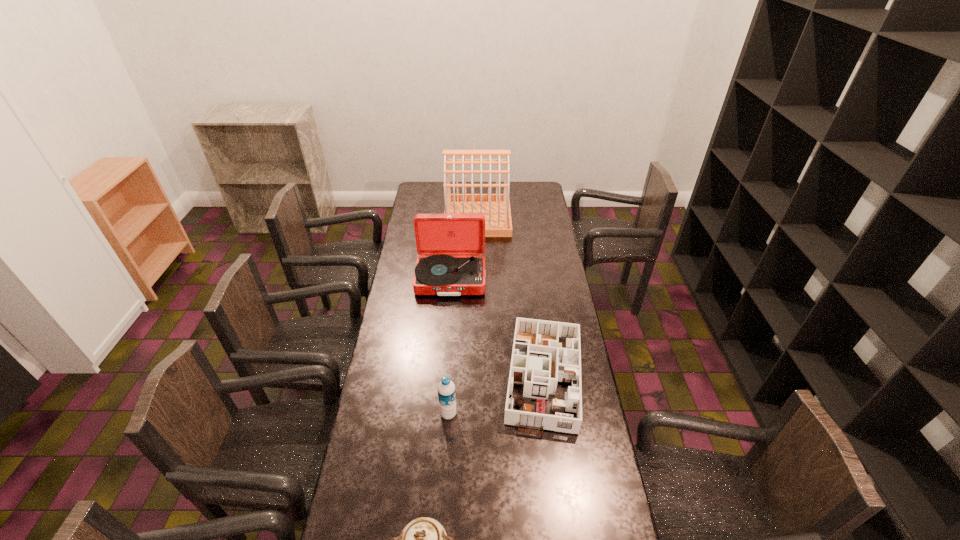
At what (x,y) coordinates should I click in order to perform the action: click on free space between the phonograph_record and the third shortest object. Please return your answer as a coordinate pair (x, y). The image size is (960, 540). Looking at the image, I should click on (449, 347).

Find the location of a particular element. empty location between the water bottle and the fourth shortest object is located at coordinates (449, 347).

Locate an element on the screen. The image size is (960, 540). free space between the birdcage and the dollhouse is located at coordinates (511, 296).

Locate which object is the closest to the water bottle. Please provide its 2D coordinates. Your answer should be formatted as a tuple, i.e. [(x, y)], where the tuple contains the x and y coordinates of a point satisfying the conditions above.

[(538, 361)]

Choose which object is the fourth nearest neighbor to the water bottle. Please provide its 2D coordinates. Your answer should be formatted as a tuple, i.e. [(x, y)], where the tuple contains the x and y coordinates of a point satisfying the conditions above.

[(495, 207)]

The height and width of the screenshot is (540, 960). What are the coordinates of `vacant region that satisfies the following two spatial constraints: 1. with an open door on the dollhouse; 2. on the left side of the tallest object` in the screenshot? It's located at (476, 374).

Where is `free spot that satisfies the following two spatial constraints: 1. with an open door on the farthest object; 2. on the left side of the shortest object`? The height and width of the screenshot is (540, 960). free spot that satisfies the following two spatial constraints: 1. with an open door on the farthest object; 2. on the left side of the shortest object is located at coordinates (476, 374).

The width and height of the screenshot is (960, 540). In order to click on free space in the image that satisfies the following two spatial constraints: 1. with an open door on the birdcage; 2. on the front-facing side of the fourth nearest object in this screenshot , I will do `click(477, 279)`.